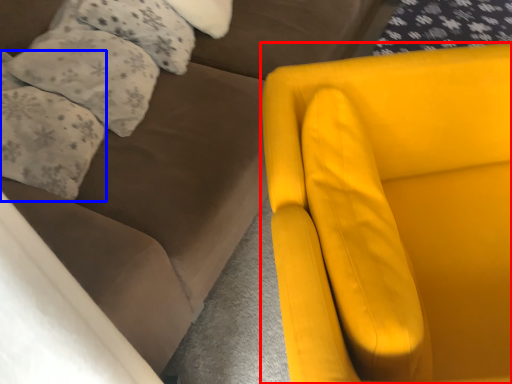
Question: Which object appears closest to the camera in this image, chair (highlighted by a red box) or pillow (highlighted by a blue box)?

Choices:
 (A) chair
 (B) pillow

Answer: (A)